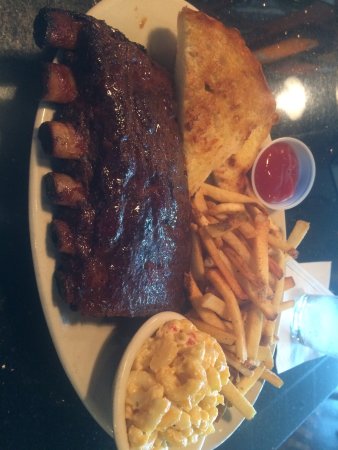
Identify the location of glass of water. (319, 315).